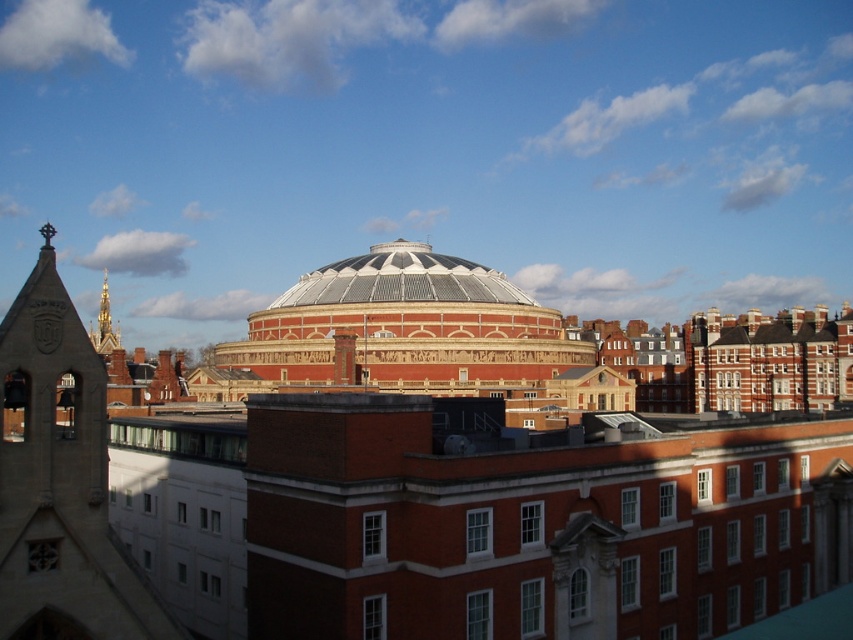
Question: Which is farther from the stone bell tower at left?

Choices:
 (A) gold textured spire at left
 (B) white textured dome at center

Answer: (A)

Question: Based on their relative distances, which object is nearer to the stone bell tower at left?

Choices:
 (A) gold textured spire at left
 (B) white textured dome at center
 (C) goldmaterial/texturespire at upper left

Answer: (B)

Question: Does stone bell tower at left appear under goldmaterial/texturespire at upper left?

Choices:
 (A) no
 (B) yes

Answer: (B)

Question: Can you confirm if stone bell tower at left is thinner than goldmaterial/texturespire at upper left?

Choices:
 (A) yes
 (B) no

Answer: (A)

Question: Estimate the real-world distances between objects in this image. Which object is closer to the stone bell tower at left?

Choices:
 (A) white textured dome at center
 (B) goldmaterial/texturespire at upper left

Answer: (A)

Question: Can you confirm if white textured dome at center is positioned below gold textured spire at left?

Choices:
 (A) no
 (B) yes

Answer: (A)